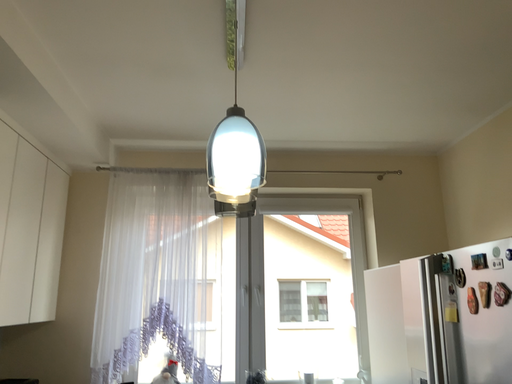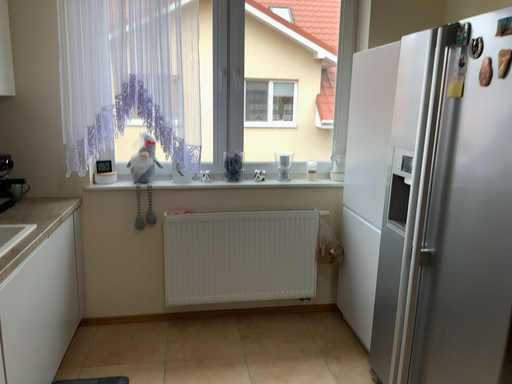
Question: Which way did the camera rotate in the video?

Choices:
 (A) rotated downward
 (B) rotated upward

Answer: (A)